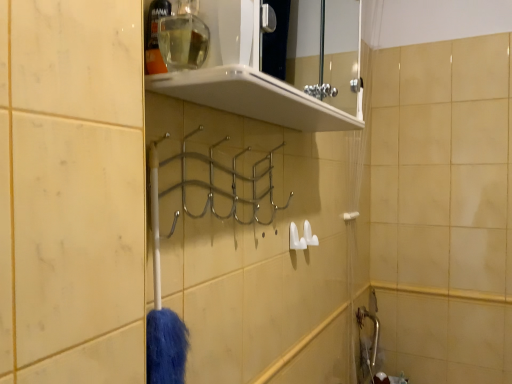
Question: Is clear plastic bottle at upper center, the first toiletry viewed from the left, wider than white plastic towel bar at right?

Choices:
 (A) yes
 (B) no

Answer: (A)

Question: From a real-world perspective, is clear plastic bottle at upper center, the first toiletry viewed from the left, located beneath white plastic towel bar at right?

Choices:
 (A) yes
 (B) no

Answer: (B)

Question: From a real-world perspective, is clear plastic bottle at upper center, the first toiletry viewed from the left, located higher than white plastic towel bar at right?

Choices:
 (A) no
 (B) yes

Answer: (B)

Question: From the image's perspective, is clear plastic bottle at upper center, the 2th toiletry in the right-to-left sequence, located above white plastic towel bar at right?

Choices:
 (A) no
 (B) yes

Answer: (B)

Question: Considering the relative sizes of clear plastic bottle at upper center, the first toiletry viewed from the left, and white plastic towel bar at right in the image provided, is clear plastic bottle at upper center, the first toiletry viewed from the left, taller than white plastic towel bar at right?

Choices:
 (A) yes
 (B) no

Answer: (A)

Question: From the image's perspective, is clear glass bottle at upper center, marked as the second toiletry in a left-to-right arrangement, located above or below white glossy shelf at upper center?

Choices:
 (A) above
 (B) below

Answer: (B)

Question: Is clear glass bottle at upper center, the first toiletry from the right, to the left or to the right of white glossy shelf at upper center in the image?

Choices:
 (A) right
 (B) left

Answer: (B)

Question: Is clear glass bottle at upper center, marked as the second toiletry in a left-to-right arrangement, wider or thinner than white glossy shelf at upper center?

Choices:
 (A) wide
 (B) thin

Answer: (B)

Question: In terms of height, does clear glass bottle at upper center, marked as the second toiletry in a left-to-right arrangement, look taller or shorter compared to white glossy shelf at upper center?

Choices:
 (A) short
 (B) tall

Answer: (A)

Question: From a real-world perspective, is clear glass bottle at upper center, the first toiletry from the right, positioned above or below clear plastic bottle at upper center, the 2th toiletry in the right-to-left sequence?

Choices:
 (A) below
 (B) above

Answer: (B)

Question: Does point (170, 56) appear closer or farther from the camera than point (150, 41)?

Choices:
 (A) closer
 (B) farther

Answer: (B)

Question: Is clear glass bottle at upper center, marked as the second toiletry in a left-to-right arrangement, spatially inside clear plastic bottle at upper center, the 2th toiletry in the right-to-left sequence, or outside of it?

Choices:
 (A) outside
 (B) inside

Answer: (A)

Question: Considering the positions of clear glass bottle at upper center, marked as the second toiletry in a left-to-right arrangement, and clear plastic bottle at upper center, the 2th toiletry in the right-to-left sequence, in the image, is clear glass bottle at upper center, marked as the second toiletry in a left-to-right arrangement, wider or thinner than clear plastic bottle at upper center, the 2th toiletry in the right-to-left sequence,?

Choices:
 (A) wide
 (B) thin

Answer: (A)

Question: Is clear plastic bottle at upper center, the first toiletry viewed from the left, taller or shorter than white plastic towel bar at right?

Choices:
 (A) tall
 (B) short

Answer: (A)

Question: From a real-world perspective, is clear plastic bottle at upper center, the first toiletry viewed from the left, above or below white plastic towel bar at right?

Choices:
 (A) below
 (B) above

Answer: (B)